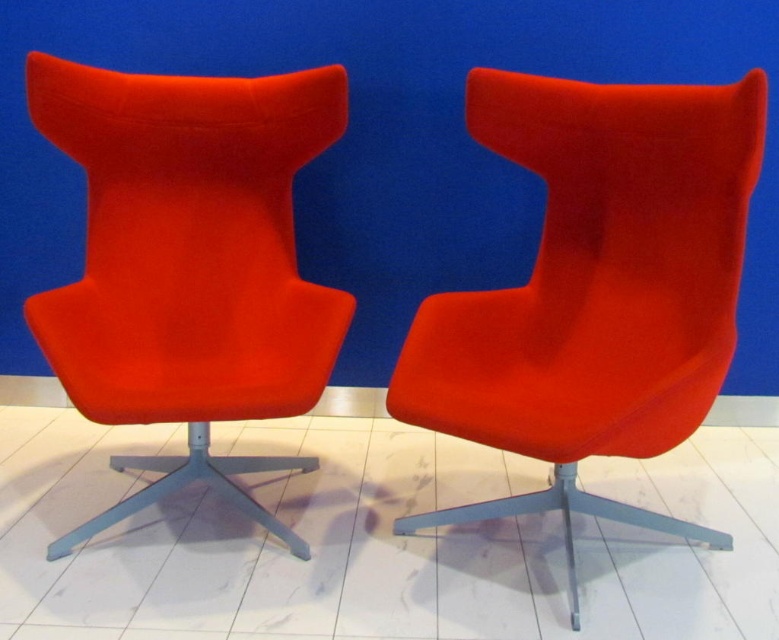
Which is below, matte red armchair at center or matte red fabric swivel chair at left?

matte red armchair at center

Describe the element at coordinates (594, 289) in the screenshot. I see `matte red armchair at center` at that location.

At what (x,y) coordinates should I click in order to perform the action: click on matte red armchair at center. Please return your answer as a coordinate pair (x, y). This screenshot has width=779, height=640. Looking at the image, I should click on (594, 289).